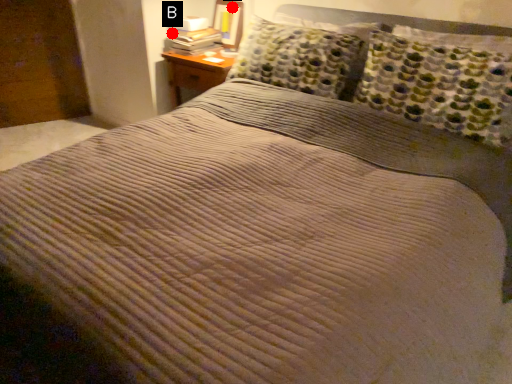
Question: Two points are circled on the image, labeled by A and B beside each circle. Which of the following is the closest to the observer?

Choices:
 (A) A is closer
 (B) B is closer

Answer: (B)